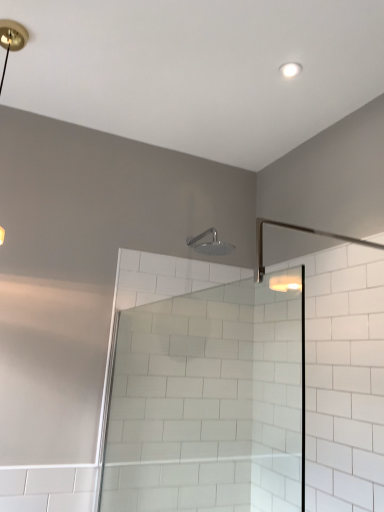
Question: Is satin nickel shower head at upper center completely or partially outside of clear glass shower door at center?

Choices:
 (A) yes
 (B) no

Answer: (A)

Question: Is satin nickel shower head at upper center positioned with its back to clear glass shower door at center?

Choices:
 (A) no
 (B) yes

Answer: (A)

Question: Could you tell me if satin nickel shower head at upper center is facing clear glass shower door at center?

Choices:
 (A) yes
 (B) no

Answer: (B)

Question: Does satin nickel shower head at upper center have a greater width compared to clear glass shower door at center?

Choices:
 (A) yes
 (B) no

Answer: (B)

Question: Is satin nickel shower head at upper center behind clear glass shower door at center?

Choices:
 (A) no
 (B) yes

Answer: (B)

Question: Is satin nickel shower head at upper center beside clear glass shower door at center?

Choices:
 (A) no
 (B) yes

Answer: (A)

Question: Is there a large distance between clear glass shower door at center and satin nickel shower head at upper center?

Choices:
 (A) yes
 (B) no

Answer: (B)

Question: Is clear glass shower door at center to the left of satin nickel shower head at upper center from the viewer's perspective?

Choices:
 (A) yes
 (B) no

Answer: (A)

Question: Does clear glass shower door at center appear on the right side of satin nickel shower head at upper center?

Choices:
 (A) no
 (B) yes

Answer: (A)

Question: Is clear glass shower door at center facing towards satin nickel shower head at upper center?

Choices:
 (A) yes
 (B) no

Answer: (B)

Question: Can you confirm if clear glass shower door at center is taller than satin nickel shower head at upper center?

Choices:
 (A) no
 (B) yes

Answer: (B)

Question: Considering the relative positions of clear glass shower door at center and satin nickel shower head at upper center in the image provided, is clear glass shower door at center in front of satin nickel shower head at upper center?

Choices:
 (A) no
 (B) yes

Answer: (B)

Question: Is matte gold light fixture at upper left next to satin nickel shower head at upper center and touching it?

Choices:
 (A) no
 (B) yes

Answer: (A)